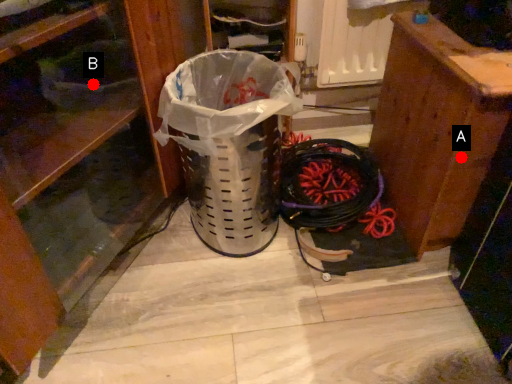
Question: Two points are circled on the image, labeled by A and B beside each circle. Which point is closer to the camera taking this photo?

Choices:
 (A) A is closer
 (B) B is closer

Answer: (A)